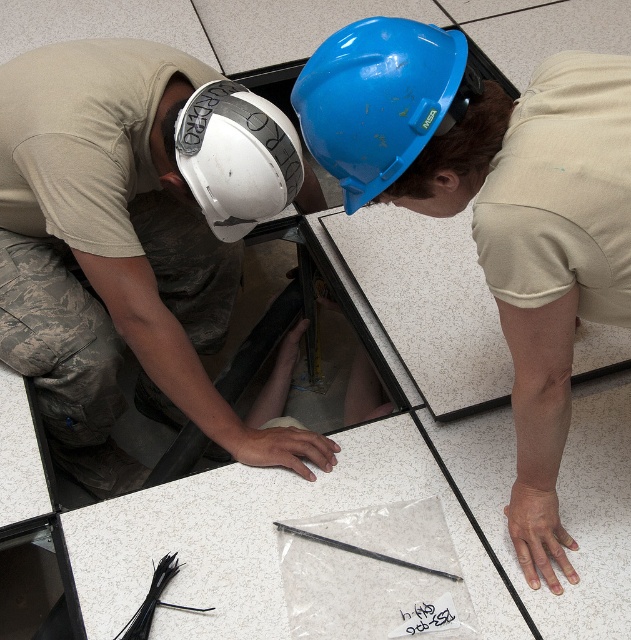
Question: Which object is closer to the camera taking this photo?

Choices:
 (A) white matte helmet at upper left
 (B) blue hard hat at center
 (C) blue glossy hard hat at upper center
 (D) white matte hard hat at left

Answer: (B)

Question: Is white matte hard hat at left behind blue glossy hard hat at upper center?

Choices:
 (A) no
 (B) yes

Answer: (B)

Question: Where is blue hard hat at center located in relation to blue glossy hard hat at upper center in the image?

Choices:
 (A) right
 (B) left

Answer: (A)

Question: Which point is farther to the camera?

Choices:
 (A) (543, 116)
 (B) (119, 464)

Answer: (B)

Question: Which of these objects is positioned farthest from the blue hard hat at center?

Choices:
 (A) white matte helmet at upper left
 (B) white matte hard hat at left
 (C) blue glossy hard hat at upper center

Answer: (B)

Question: Is blue hard hat at center bigger than white matte helmet at upper left?

Choices:
 (A) no
 (B) yes

Answer: (B)